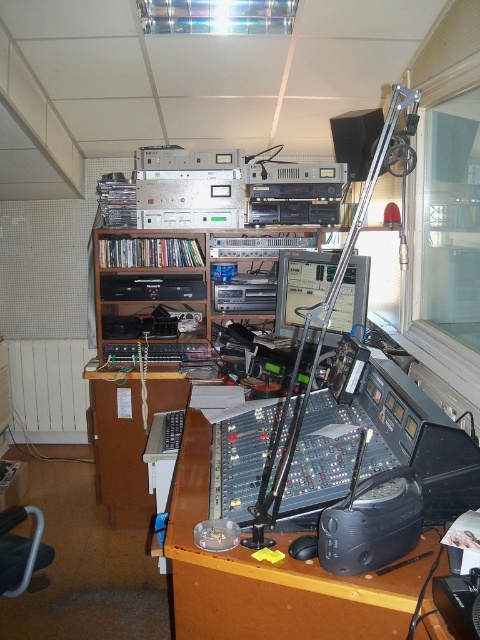
Question: Which of the following is the closest to the observer?

Choices:
 (A) (354, 124)
 (B) (301, 579)

Answer: (B)

Question: Which object appears farthest from the camera in this image?

Choices:
 (A) brown wooden desk at center
 (B) black matte speaker at upper center

Answer: (B)

Question: Is brown wooden desk at center smaller than black matte speaker at upper center?

Choices:
 (A) yes
 (B) no

Answer: (B)

Question: Is brown wooden desk at center bigger than black matte speaker at upper center?

Choices:
 (A) yes
 (B) no

Answer: (A)

Question: Does brown wooden desk at center appear on the left side of black matte speaker at upper center?

Choices:
 (A) no
 (B) yes

Answer: (B)